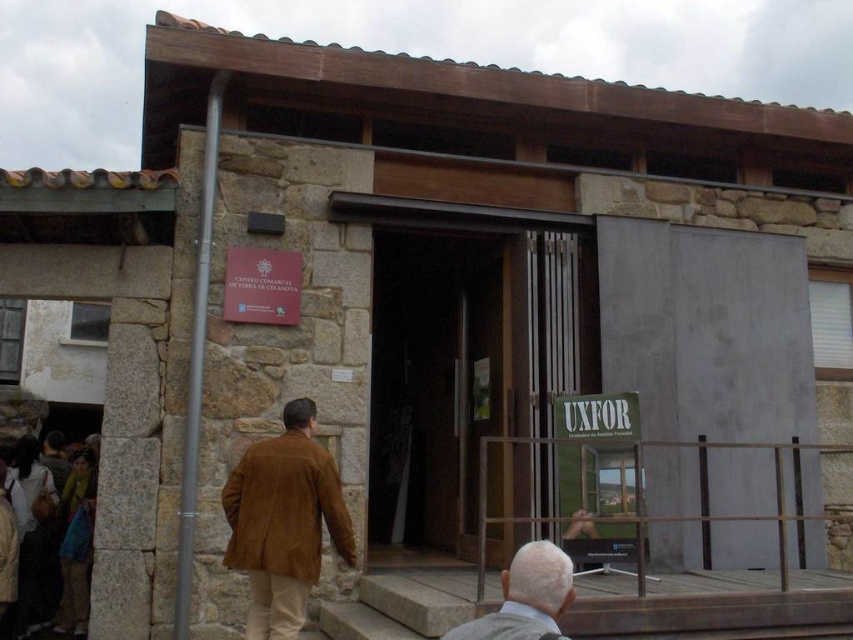
You are standing in front of the building and want to enter through the dark wood door at center. Based on the coordinates provided, can you determine if the door is positioned to your left or right side relative to your facing direction?

The dark wood door at center is located at coordinates point (431, 385), which places it directly in front of you, not to the left or right side.

You are a delivery person trying to deliver a package to the dark wood door at center. However, there is a gray suede jacket at lower center in the way. Can you fit the package through the door without moving the jacket?

The dark wood door at center is wider than the gray suede jacket at lower center, so yes, the package can fit through the door without moving the jacket since the door is wider than the jacket.